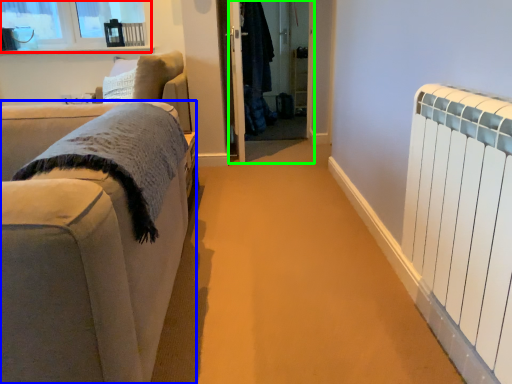
Question: Which object is positioned farthest from window (highlighted by a red box)? Select from studio couch (highlighted by a blue box) and screen door (highlighted by a green box).

Choices:
 (A) studio couch
 (B) screen door

Answer: (A)